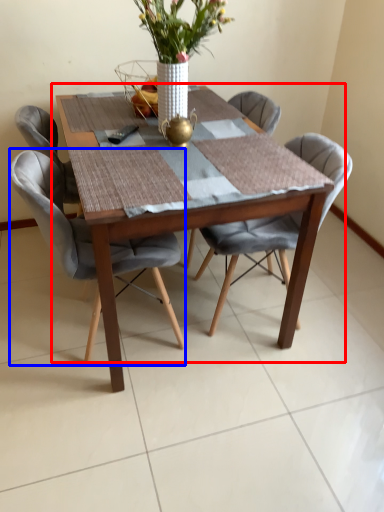
Question: Which object is further to the camera taking this photo, kitchen & dining room table (highlighted by a red box) or chair (highlighted by a blue box)?

Choices:
 (A) kitchen & dining room table
 (B) chair

Answer: (B)